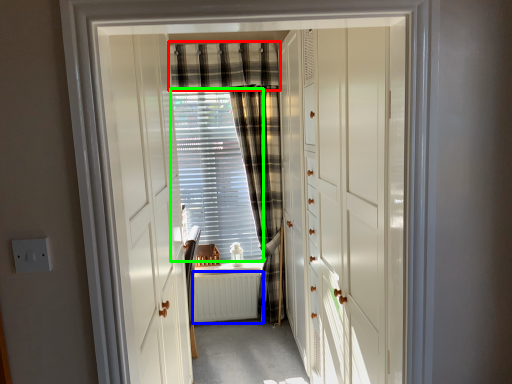
Question: Which object is positioned closest to curtain (highlighted by a red box)? Select from radiator (highlighted by a blue box) and blind (highlighted by a green box).

Choices:
 (A) radiator
 (B) blind

Answer: (B)